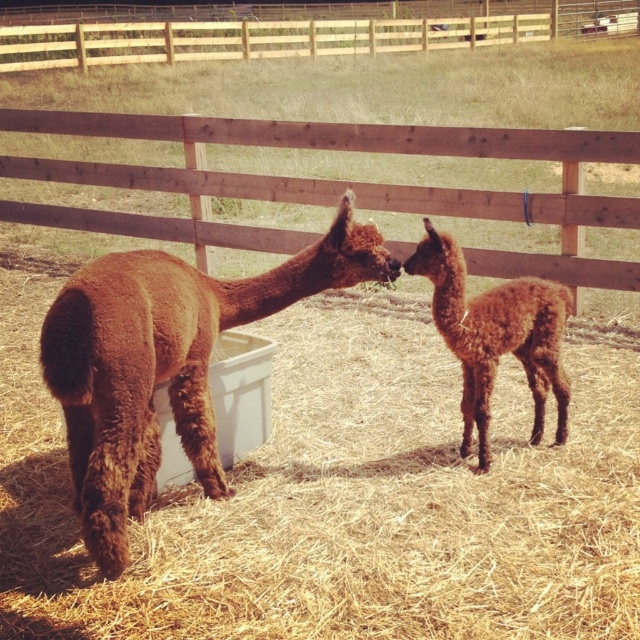
You are a farmer who needs to separate two alpacas using a divider that is 36 inches wide. You see the brown woolen alpaca at center and the brown fuzzy alpaca at center. Can the divider fit between them without touching either animal?

The distance between the brown woolen alpaca at center and the brown fuzzy alpaca at center is 35.33 inches. Since the divider is 36 inches wide, it is slightly too wide to fit between them without touching the animals.

You are a farmer who wants to separate the two alpacas in the enclosure. You have a divider that can be placed between them. Based on their positions, can you place the divider between the brown woolen alpaca at center and the brown fuzzy alpaca at center?

The brown woolen alpaca at center is positioned under the brown fuzzy alpaca at center, so placing a divider between them might not be possible since they are vertically aligned rather than side by side.